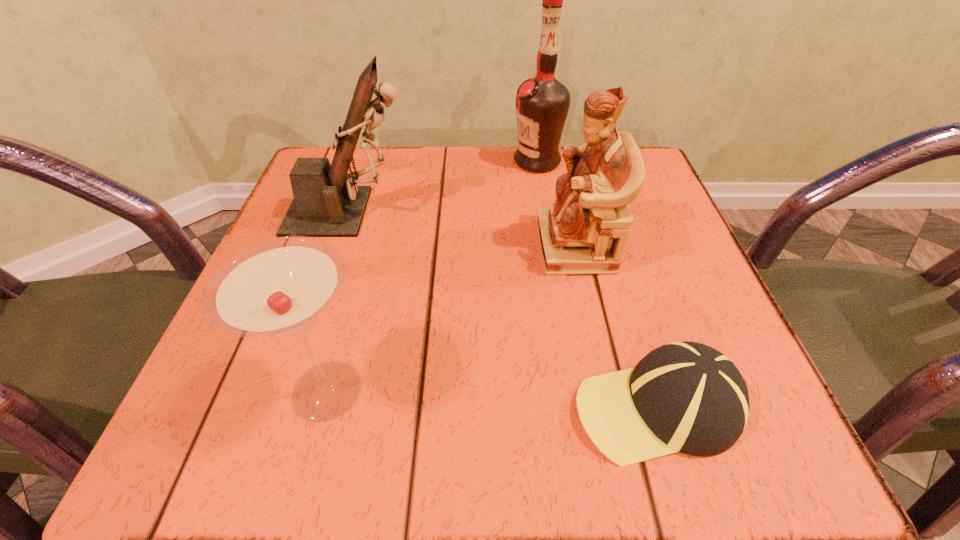
Where is `empty space that is in between the farthest object and the baseball cap`? Image resolution: width=960 pixels, height=540 pixels. empty space that is in between the farthest object and the baseball cap is located at coordinates (596, 284).

Find the location of `vacant space in between the martini and the baseball cap`. vacant space in between the martini and the baseball cap is located at coordinates (492, 399).

Locate which object ranks fourth in proximity to the right figurine. Please provide its 2D coordinates. Your answer should be formatted as a tuple, i.e. [(x, y)], where the tuple contains the x and y coordinates of a point satisfying the conditions above.

[(279, 288)]

Point out which object is positioned as the second nearest to the shortest object. Please provide its 2D coordinates. Your answer should be formatted as a tuple, i.e. [(x, y)], where the tuple contains the x and y coordinates of a point satisfying the conditions above.

[(279, 288)]

Image resolution: width=960 pixels, height=540 pixels. What are the coordinates of `free spot that satisfies the following two spatial constraints: 1. on the front-facing side of the martini; 2. on the right side of the left figurine` in the screenshot? It's located at (293, 390).